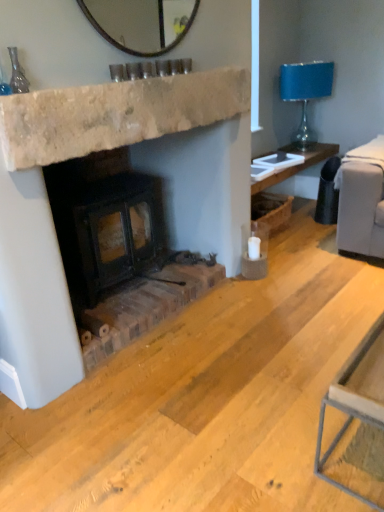
Image resolution: width=384 pixels, height=512 pixels. I want to click on blue glass lampshade at upper right, so click(305, 93).

Find the location of a particular element. This screenshot has width=384, height=512. rustic brick wood burning stove at center is located at coordinates (119, 251).

The image size is (384, 512). What are the coordinates of `natural stone fireplace at center` in the screenshot? It's located at (115, 114).

The image size is (384, 512). In order to click on blue glass lampshade at upper right in this screenshot , I will do `click(305, 93)`.

Measure the distance between rustic brick wood burning stove at center and natural stone fireplace at center.

A distance of 30.61 inches exists between rustic brick wood burning stove at center and natural stone fireplace at center.

Can you confirm if rustic brick wood burning stove at center is thinner than natural stone fireplace at center?

Incorrect, the width of rustic brick wood burning stove at center is not less than that of natural stone fireplace at center.

Considering the points (61, 221) and (63, 125), which point is behind, point (61, 221) or point (63, 125)?

The point (61, 221) is more distant.

Is natural stone fireplace at center oriented towards blue glass lampshade at upper right?

No, natural stone fireplace at center is not oriented towards blue glass lampshade at upper right.

Consider the image. Are natural stone fireplace at center and blue glass lampshade at upper right located far from each other?

Yes.

Considering their positions, is natural stone fireplace at center located in front of or behind blue glass lampshade at upper right?

Clearly, natural stone fireplace at center is in front of blue glass lampshade at upper right.

In the image, there is a natural stone fireplace at center. Where is `lamp below it (from a real-world perspective)`? lamp below it (from a real-world perspective) is located at coordinates (305, 93).

Does natural stone fireplace at center have a smaller size compared to rustic brick wood burning stove at center?

Indeed, natural stone fireplace at center has a smaller size compared to rustic brick wood burning stove at center.

Can you confirm if natural stone fireplace at center is positioned to the left of rustic brick wood burning stove at center?

No, natural stone fireplace at center is not to the left of rustic brick wood burning stove at center.

From a real-world perspective, is natural stone fireplace at center located higher than rustic brick wood burning stove at center?

Yes.

Which is nearer, (127, 120) or (125, 209)?

The point (127, 120) is more forward.

Can you tell me how much rustic brick wood burning stove at center and blue glass lampshade at upper right differ in facing direction?

3.87 degrees separate the facing orientations of rustic brick wood burning stove at center and blue glass lampshade at upper right.

Which object is further away from the camera, rustic brick wood burning stove at center or blue glass lampshade at upper right?

blue glass lampshade at upper right is further from the camera.

Is rustic brick wood burning stove at center located outside blue glass lampshade at upper right?

Yes.

Could you tell me if rustic brick wood burning stove at center is turned towards blue glass lampshade at upper right?

No, rustic brick wood burning stove at center is not facing towards blue glass lampshade at upper right.

From the image's perspective, which one is positioned higher, blue glass lampshade at upper right or natural stone fireplace at center?

blue glass lampshade at upper right appears higher in the image.

Identify the location of lamp that appears above the natural stone fireplace at center (from the image's perspective). This screenshot has height=512, width=384. (305, 93).

From a real-world perspective, is blue glass lampshade at upper right positioned above or below natural stone fireplace at center?

blue glass lampshade at upper right is below natural stone fireplace at center.

Is blue glass lampshade at upper right further to the viewer compared to rustic brick wood burning stove at center?

Yes, it is behind rustic brick wood burning stove at center.

Which is farther from the camera, (306, 119) or (54, 192)?

The point (306, 119) is behind.

From a real-world perspective, is blue glass lampshade at upper right positioned under rustic brick wood burning stove at center based on gravity?

No.

How far apart are blue glass lampshade at upper right and rustic brick wood burning stove at center?

blue glass lampshade at upper right and rustic brick wood burning stove at center are 1.98 meters apart from each other.

Locate an element on the screen. wood burning stove on the left side of natural stone fireplace at center is located at coordinates (119, 251).

At what (x,y) coordinates should I click in order to perform the action: click on counter top located above the blue glass lampshade at upper right (from a real-world perspective). Please return your answer as a coordinate pair (x, y). Looking at the image, I should click on (115, 114).

Considering their positions, is natural stone fireplace at center positioned closer to rustic brick wood burning stove at center than blue glass lampshade at upper right?

natural stone fireplace at center is positioned closer to the anchor rustic brick wood burning stove at center.

Based on their spatial positions, is blue glass lampshade at upper right or rustic brick wood burning stove at center closer to natural stone fireplace at center?

The object closer to natural stone fireplace at center is rustic brick wood burning stove at center.

When comparing their distances from blue glass lampshade at upper right, does rustic brick wood burning stove at center or natural stone fireplace at center seem further?

rustic brick wood burning stove at center lies further to blue glass lampshade at upper right than the other object.

Based on their spatial positions, is blue glass lampshade at upper right or natural stone fireplace at center further from rustic brick wood burning stove at center?

blue glass lampshade at upper right lies further to rustic brick wood burning stove at center than the other object.

Consider the image. Based on their spatial positions, is rustic brick wood burning stove at center or blue glass lampshade at upper right further from natural stone fireplace at center?

blue glass lampshade at upper right is positioned further to the anchor natural stone fireplace at center.

Based on their spatial positions, is natural stone fireplace at center or rustic brick wood burning stove at center further from blue glass lampshade at upper right?

rustic brick wood burning stove at center lies further to blue glass lampshade at upper right than the other object.

Where is `wood burning stove positioned between natural stone fireplace at center and blue glass lampshade at upper right from near to far`? Image resolution: width=384 pixels, height=512 pixels. wood burning stove positioned between natural stone fireplace at center and blue glass lampshade at upper right from near to far is located at coordinates (119, 251).